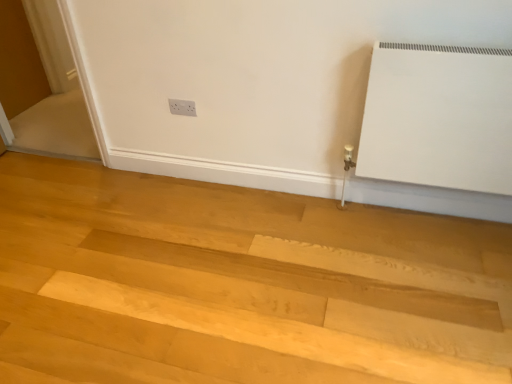
What is the approximate width of natural wood floor at lower center?

3.10 meters.

This screenshot has width=512, height=384. What do you see at coordinates (182, 107) in the screenshot?
I see `white plastic electric outlet at upper center` at bounding box center [182, 107].

Identify the location of white glossy screen door at left. (44, 63).

From the image's perspective, who appears lower, natural wood floor at lower center or white plastic electric outlet at upper center?

natural wood floor at lower center appears lower in the image.

Between natural wood floor at lower center and white plastic electric outlet at upper center, which one has less height?

With less height is natural wood floor at lower center.

Image resolution: width=512 pixels, height=384 pixels. Identify the location of stairwell that appears below the white plastic electric outlet at upper center (from the image's perspective). (251, 323).

Are natural wood floor at lower center and white plastic electric outlet at upper center far apart?

natural wood floor at lower center is far away from white plastic electric outlet at upper center.

Consider the image. From a real-world perspective, who is located lower, white glossy screen door at left or natural wood floor at lower center?

natural wood floor at lower center is physically lower.

Can you confirm if white glossy screen door at left is smaller than natural wood floor at lower center?

Yes, white glossy screen door at left is smaller than natural wood floor at lower center.

Is white glossy screen door at left situated inside natural wood floor at lower center or outside?

white glossy screen door at left exists outside the volume of natural wood floor at lower center.

Can you tell me how much white glossy screen door at left and natural wood floor at lower center differ in facing direction?

The angular difference between white glossy screen door at left and natural wood floor at lower center is 88.9 degrees.

Where is `screen door above the white plastic electric outlet at upper center (from the image's perspective)`? This screenshot has height=384, width=512. screen door above the white plastic electric outlet at upper center (from the image's perspective) is located at coordinates (44, 63).

From a real-world perspective, is white plastic electric outlet at upper center over white glossy screen door at left?

No, from a real-world perspective, white plastic electric outlet at upper center is not above white glossy screen door at left.

In the scene shown: Measure the distance from white plastic electric outlet at upper center to white glossy screen door at left.

A distance of 1.45 meters exists between white plastic electric outlet at upper center and white glossy screen door at left.

Is natural wood floor at lower center inside white plastic electric outlet at upper center?

No, natural wood floor at lower center is located outside of white plastic electric outlet at upper center.

Is white plastic electric outlet at upper center far away from natural wood floor at lower center?

That's right, there is a large distance between white plastic electric outlet at upper center and natural wood floor at lower center.

Is white plastic electric outlet at upper center facing towards natural wood floor at lower center?

No, white plastic electric outlet at upper center is not oriented towards natural wood floor at lower center.

Is white glossy screen door at left surrounding white plastic electric outlet at upper center?

Actually, white plastic electric outlet at upper center is outside white glossy screen door at left.

From a real-world perspective, is white glossy screen door at left positioned above or below white plastic electric outlet at upper center?

In terms of real-world spatial position, white glossy screen door at left is above white plastic electric outlet at upper center.

Is white glossy screen door at left aimed at white plastic electric outlet at upper center?

No, white glossy screen door at left is not turned towards white plastic electric outlet at upper center.

How many degrees apart are the facing directions of white glossy screen door at left and white plastic electric outlet at upper center?

The facing directions of white glossy screen door at left and white plastic electric outlet at upper center are 1.46 degrees apart.

Is point (381, 358) more distant than point (88, 133)?

No, it is not.

From the image's perspective, is natural wood floor at lower center located above white glossy screen door at left?

Incorrect, from the image's perspective, natural wood floor at lower center is lower than white glossy screen door at left.

Can you confirm if natural wood floor at lower center is shorter than white glossy screen door at left?

Indeed, natural wood floor at lower center has a lesser height compared to white glossy screen door at left.

Can we say natural wood floor at lower center lies outside white glossy screen door at left?

natural wood floor at lower center lies outside white glossy screen door at left's area.

Find the location of a particular element. This screenshot has height=384, width=512. electric outlet on the right of natural wood floor at lower center is located at coordinates (182, 107).

The height and width of the screenshot is (384, 512). I want to click on screen door located above the natural wood floor at lower center (from a real-world perspective), so click(x=44, y=63).

Which object lies further to the anchor point white glossy screen door at left, natural wood floor at lower center or white plastic electric outlet at upper center?

Based on the image, natural wood floor at lower center appears to be further to white glossy screen door at left.

Considering their positions, is white glossy screen door at left positioned closer to natural wood floor at lower center than white plastic electric outlet at upper center?

white plastic electric outlet at upper center is positioned closer to the anchor natural wood floor at lower center.

When comparing their distances from natural wood floor at lower center, does white plastic electric outlet at upper center or white glossy screen door at left seem closer?

white plastic electric outlet at upper center lies closer to natural wood floor at lower center than the other object.

When comparing their distances from white plastic electric outlet at upper center, does natural wood floor at lower center or white glossy screen door at left seem closer?

Among the two, natural wood floor at lower center is located nearer to white plastic electric outlet at upper center.

Which object lies further to the anchor point white plastic electric outlet at upper center, white glossy screen door at left or natural wood floor at lower center?

white glossy screen door at left is positioned further to the anchor white plastic electric outlet at upper center.

From the image, which object appears to be nearer to white glossy screen door at left, white plastic electric outlet at upper center or natural wood floor at lower center?

white plastic electric outlet at upper center is positioned closer to the anchor white glossy screen door at left.

Locate an element on the screen. The height and width of the screenshot is (384, 512). screen door positioned between natural wood floor at lower center and white plastic electric outlet at upper center from near to far is located at coordinates (44, 63).